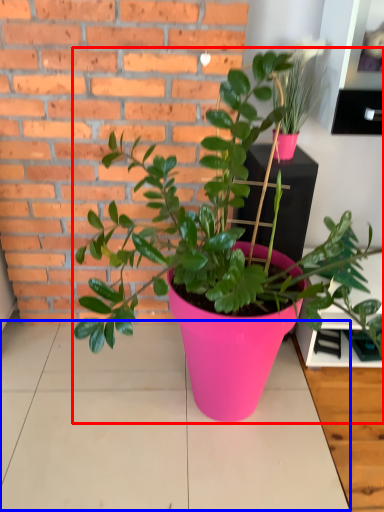
Question: Which of the following is the farthest to the observer, houseplant (highlighted by a red box) or table top (highlighted by a blue box)?

Choices:
 (A) houseplant
 (B) table top

Answer: (B)